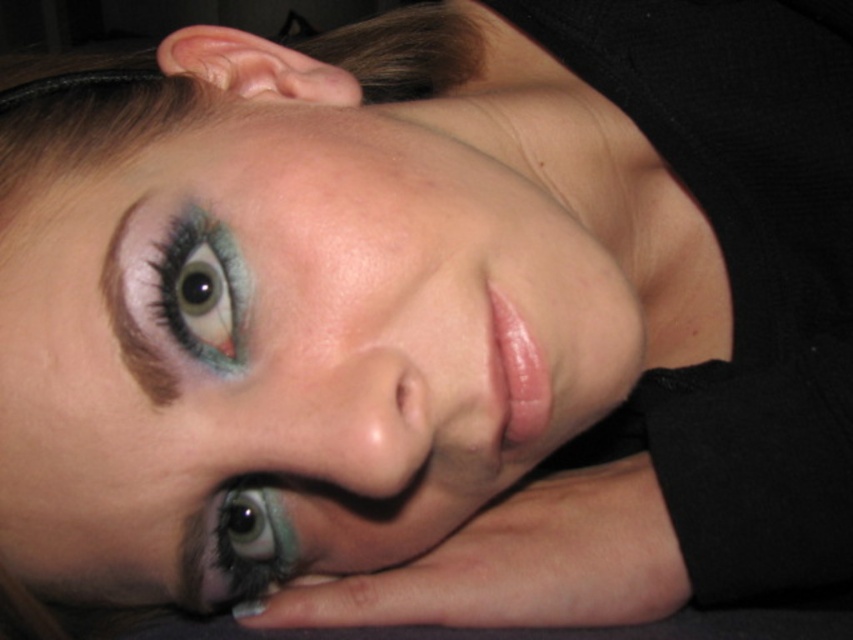
Question: Does shiny blue eye at lower left lie behind brown matte eyebrow at upper left?

Choices:
 (A) yes
 (B) no

Answer: (A)

Question: Which of these objects is positioned farthest from the matte green eye at upper left?

Choices:
 (A) shiny blue eye at lower left
 (B) smooth skin face at center

Answer: (A)

Question: Which of the following is the farthest from the observer?

Choices:
 (A) matte green eye at upper left
 (B) brown matte eyebrow at upper left

Answer: (A)

Question: Does matte green eye at upper left appear on the right side of shiny blue eye at lower left?

Choices:
 (A) no
 (B) yes

Answer: (A)

Question: Which object is the closest to the matte green eye at upper left?

Choices:
 (A) brown matte eyebrow at upper left
 (B) shiny blue eye at lower left
 (C) smooth skin face at center

Answer: (A)

Question: Does smooth skin face at center appear over matte green eye at upper left?

Choices:
 (A) no
 (B) yes

Answer: (A)